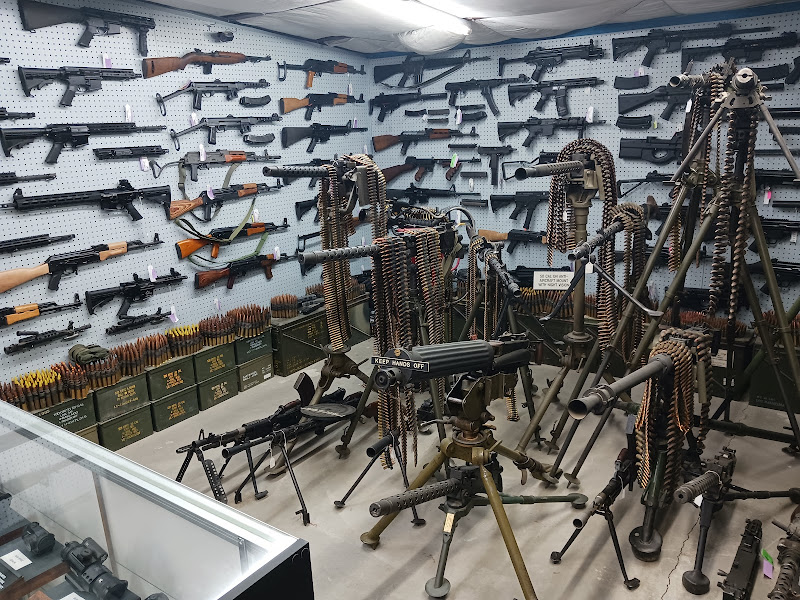
The width and height of the screenshot is (800, 600). I want to click on tile, so click(x=362, y=566).